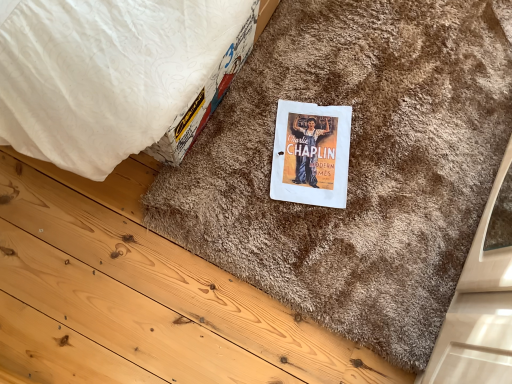
Question: Considering the relative positions of brown shaggy doormat at center and white paper at center in the image provided, is brown shaggy doormat at center to the left or to the right of white paper at center?

Choices:
 (A) left
 (B) right

Answer: (B)

Question: In terms of width, does brown shaggy doormat at center look wider or thinner when compared to white paper at center?

Choices:
 (A) wide
 (B) thin

Answer: (A)

Question: In the image, is brown shaggy doormat at center positioned in front of or behind white paper at center?

Choices:
 (A) behind
 (B) front

Answer: (B)

Question: Considering the positions of white paper at center and brown shaggy doormat at center in the image, is white paper at center wider or thinner than brown shaggy doormat at center?

Choices:
 (A) wide
 (B) thin

Answer: (B)

Question: Is white paper at center in front of or behind brown shaggy doormat at center in the image?

Choices:
 (A) behind
 (B) front

Answer: (A)

Question: Is white paper at center to the left or to the right of brown shaggy doormat at center in the image?

Choices:
 (A) right
 (B) left

Answer: (B)

Question: From their relative heights in the image, would you say white paper at center is taller or shorter than brown shaggy doormat at center?

Choices:
 (A) tall
 (B) short

Answer: (B)